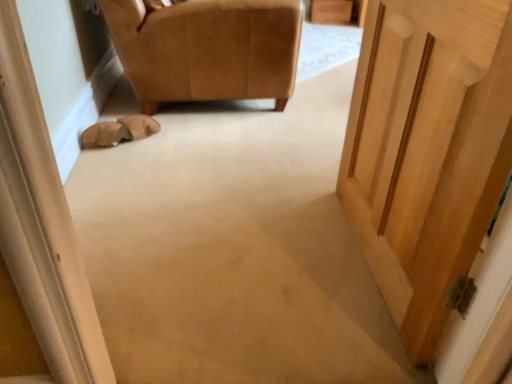
Question: From the image's perspective, is leather at upper left above or below leather at left?

Choices:
 (A) above
 (B) below

Answer: (A)

Question: From a real-world perspective, relative to leather at left, is leather at upper left vertically above or below?

Choices:
 (A) below
 (B) above

Answer: (B)

Question: Is leather at upper left taller or shorter than leather at left?

Choices:
 (A) short
 (B) tall

Answer: (B)

Question: From a real-world perspective, relative to leather at upper left, is leather at left vertically above or below?

Choices:
 (A) below
 (B) above

Answer: (A)

Question: Do you think leather at left is within leather at upper left, or outside of it?

Choices:
 (A) inside
 (B) outside

Answer: (B)

Question: In terms of width, does leather at left look wider or thinner when compared to leather at upper left?

Choices:
 (A) thin
 (B) wide

Answer: (A)

Question: Looking at the image, does leather at left seem bigger or smaller compared to leather at upper left?

Choices:
 (A) small
 (B) big

Answer: (A)